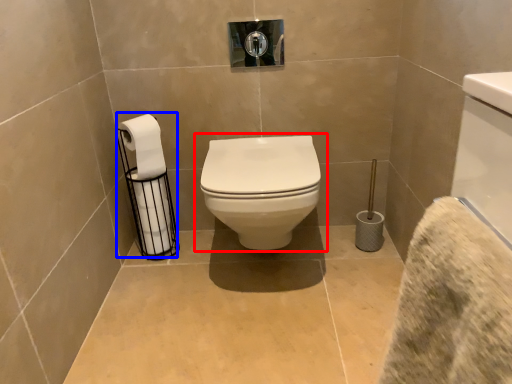
Question: Which of the following is the closest to the observer, toilet (highlighted by a red box) or toilet paper (highlighted by a blue box)?

Choices:
 (A) toilet
 (B) toilet paper

Answer: (A)